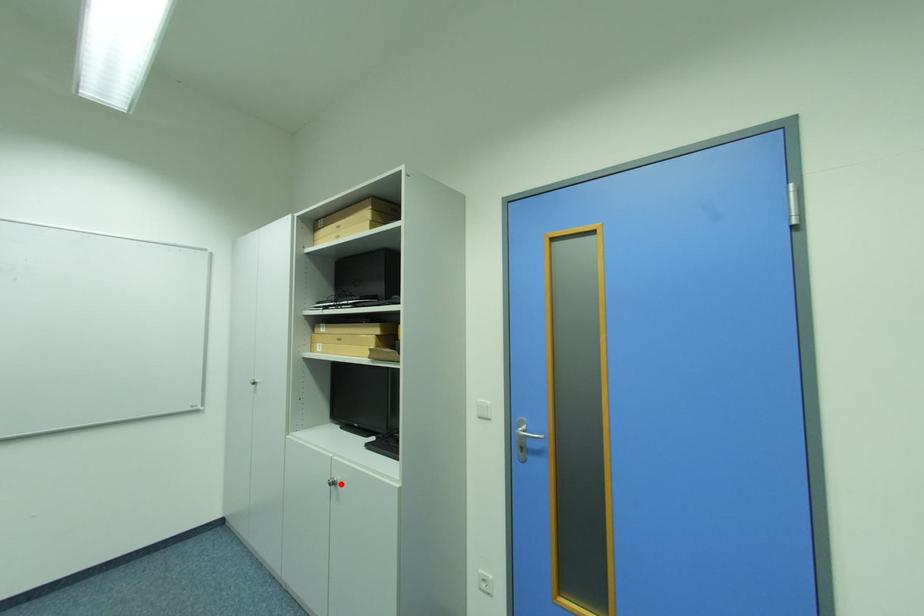
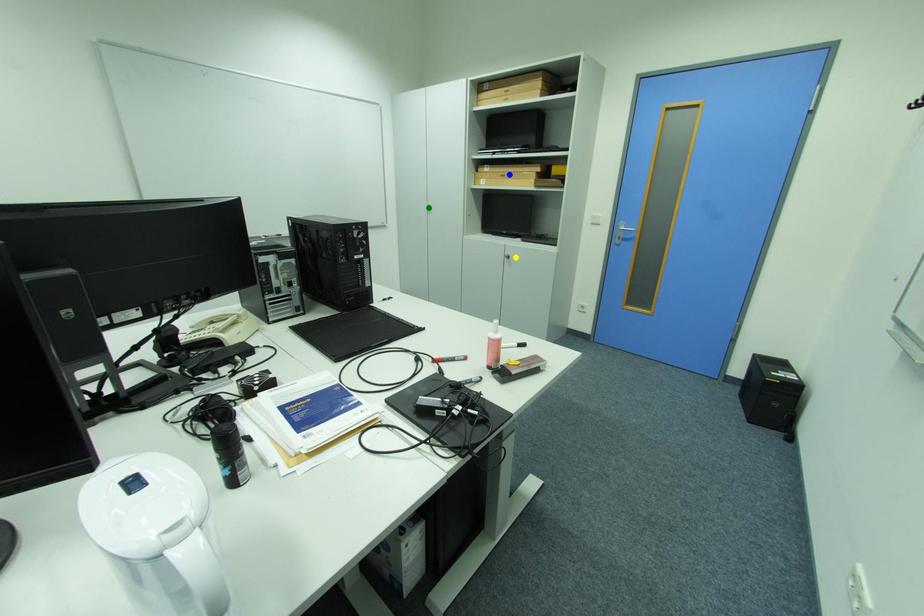
Question: I am providing you with two images of the same scene from different viewpoints. A red point is marked on the first image. You are given multiple points on the second image. Can you choose the point in image 2 that corresponds to the point in image 1?

Choices:
 (A) yellow point
 (B) green point
 (C) blue point

Answer: (A)